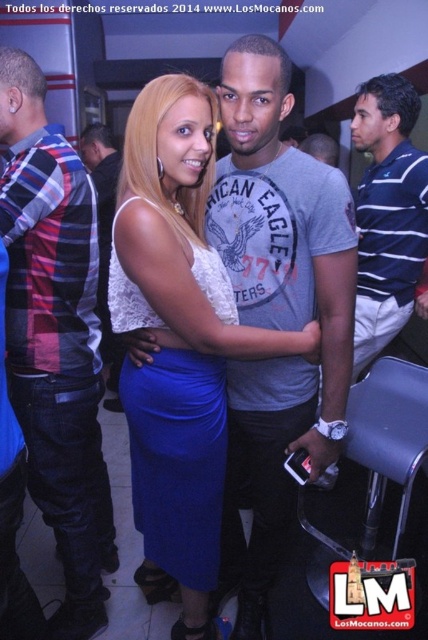
Between blue striped polo shirt at right and matte plaid shirt at left, which one appears on the right side from the viewer's perspective?

blue striped polo shirt at right is more to the right.

Between point (385, 344) and point (92, 140), which one is positioned in front?

Point (385, 344) is in front.

Who is more distant from viewer, (425, 230) or (103, 150)?

The point (103, 150) is more distant.

In order to click on blue striped polo shirt at right in this screenshot , I will do `click(388, 212)`.

From the picture: Does plaid fabric shirt at left have a smaller size compared to matte plaid shirt at left?

Incorrect, plaid fabric shirt at left is not smaller in size than matte plaid shirt at left.

Which is behind, point (41, 259) or point (101, 156)?

Positioned behind is point (101, 156).

Locate an element on the screen. This screenshot has height=640, width=428. plaid fabric shirt at left is located at coordinates (56, 339).

Does lace fabric dress at center appear on the left side of blue striped polo shirt at right?

Indeed, lace fabric dress at center is positioned on the left side of blue striped polo shirt at right.

Is point (214, 129) less distant than point (383, 134)?

Yes, it is.

You are a GUI agent. You are given a task and a screenshot of the screen. Output one action in this format:
    pyautogui.click(x=<x>, y=<y>)
    Task: Click on the lace fabric dress at center
    This screenshot has width=428, height=640.
    Given the screenshot: What is the action you would take?
    pyautogui.click(x=178, y=344)